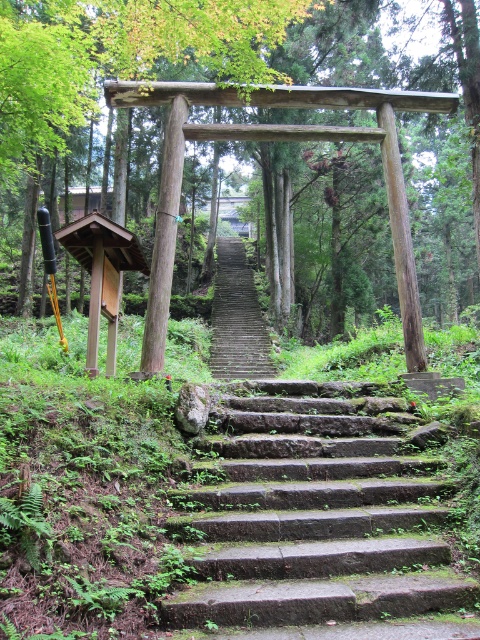
Who is positioned more to the right, green mossy stone stairs at center or stone steps at center?

Positioned to the right is green mossy stone stairs at center.

Between green mossy stone stairs at center and stone steps at center, which one appears on the left side from the viewer's perspective?

stone steps at center

Where is `green mossy stone stairs at center`? The width and height of the screenshot is (480, 640). green mossy stone stairs at center is located at coordinates (317, 522).

From the picture: Between green mossy stone stairs at center and green wood tree at center, which one is positioned lower?

green mossy stone stairs at center is lower down.

Does green mossy stone stairs at center lie behind green wood tree at center?

No.

At what (x,y) coordinates should I click in order to perform the action: click on green mossy stone stairs at center. Please return your answer as a coordinate pair (x, y). Looking at the image, I should click on point(317,522).

Locate an element on the screen. Image resolution: width=480 pixels, height=640 pixels. green mossy stone stairs at center is located at coordinates (317, 522).

Can you confirm if green wood tree at center is thinner than stone steps at center?

In fact, green wood tree at center might be wider than stone steps at center.

Can you confirm if green wood tree at center is shorter than stone steps at center?

Incorrect, green wood tree at center's height does not fall short of stone steps at center's.

Measure the distance between point (143,160) and camera.

The distance of point (143,160) from camera is 22.20 meters.

Where is `green wood tree at center`? Image resolution: width=480 pixels, height=640 pixels. green wood tree at center is located at coordinates (403, 116).